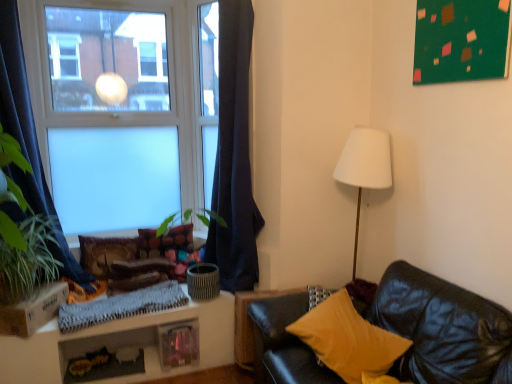
Question: Is dark blue fabric curtain at left, the 2th curtain in the right-to-left sequence, completely or partially outside of green leafy plant at left?

Choices:
 (A) yes
 (B) no

Answer: (A)

Question: From a real-world perspective, is dark blue fabric curtain at left, the 2th curtain in the right-to-left sequence, located beneath green leafy plant at left?

Choices:
 (A) yes
 (B) no

Answer: (B)

Question: From the image's perspective, is dark blue fabric curtain at left, the 2th curtain in the right-to-left sequence, above green leafy plant at left?

Choices:
 (A) yes
 (B) no

Answer: (A)

Question: Is green leafy plant at left located within dark blue fabric curtain at left, which is the 1th curtain from left to right?

Choices:
 (A) yes
 (B) no

Answer: (A)

Question: Does dark blue fabric curtain at left, the 2th curtain in the right-to-left sequence, appear on the left side of green leafy plant at left?

Choices:
 (A) yes
 (B) no

Answer: (A)

Question: From a real-world perspective, is matte glass window at upper left physically located above or below yellow fabric pillow at lower right, the 1th pillow in the right-to-left sequence?

Choices:
 (A) above
 (B) below

Answer: (A)

Question: Is matte glass window at upper left inside the boundaries of yellow fabric pillow at lower right, the 1th pillow in the front-to-back sequence, or outside?

Choices:
 (A) inside
 (B) outside

Answer: (B)

Question: Is matte glass window at upper left taller or shorter than yellow fabric pillow at lower right, the 1th pillow in the right-to-left sequence?

Choices:
 (A) short
 (B) tall

Answer: (B)

Question: From the image's perspective, is matte glass window at upper left positioned above or below yellow fabric pillow at lower right, which ranks as the third pillow in left-to-right order?

Choices:
 (A) below
 (B) above

Answer: (B)

Question: Considering the positions of green leafy plant at left and textured brown pillow at lower left, positioned as the second pillow in back-to-front order, in the image, is green leafy plant at left bigger or smaller than textured brown pillow at lower left, positioned as the second pillow in back-to-front order,?

Choices:
 (A) big
 (B) small

Answer: (A)

Question: From a real-world perspective, is green leafy plant at left positioned above or below textured brown pillow at lower left, arranged as the 1th pillow when viewed from the left?

Choices:
 (A) above
 (B) below

Answer: (A)

Question: Visually, is green leafy plant at left positioned to the left or to the right of textured brown pillow at lower left, the 3th pillow positioned from the right?

Choices:
 (A) left
 (B) right

Answer: (A)

Question: Considering the positions of point (8, 289) and point (102, 271), is point (8, 289) closer or farther from the camera than point (102, 271)?

Choices:
 (A) closer
 (B) farther

Answer: (A)

Question: Is yellow fabric pillow at lower right, the 1th pillow in the front-to-back sequence, spatially inside dark blue fabric curtain at left, which is the 1th curtain from left to right, or outside of it?

Choices:
 (A) outside
 (B) inside

Answer: (A)

Question: From a real-world perspective, relative to dark blue fabric curtain at left, which is the 1th curtain from left to right, is yellow fabric pillow at lower right, which ranks as the third pillow in left-to-right order, vertically above or below?

Choices:
 (A) above
 (B) below

Answer: (B)